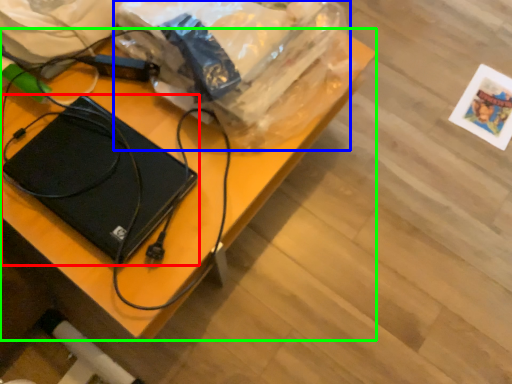
Question: Considering the real-world distances, which object is farthest from laptop (highlighted by a red box)? grocery bag (highlighted by a blue box) or desk (highlighted by a green box)?

Choices:
 (A) grocery bag
 (B) desk

Answer: (A)